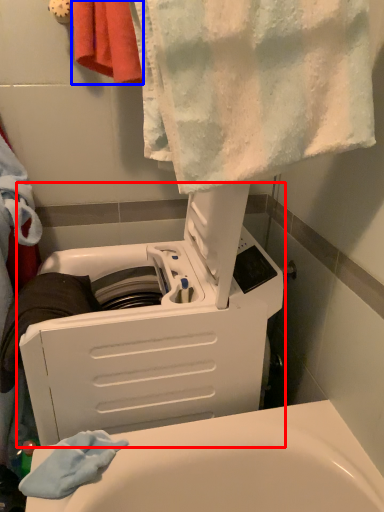
Question: Which object is further to the camera taking this photo, appliance (highlighted by a red box) or towel (highlighted by a blue box)?

Choices:
 (A) appliance
 (B) towel

Answer: (B)